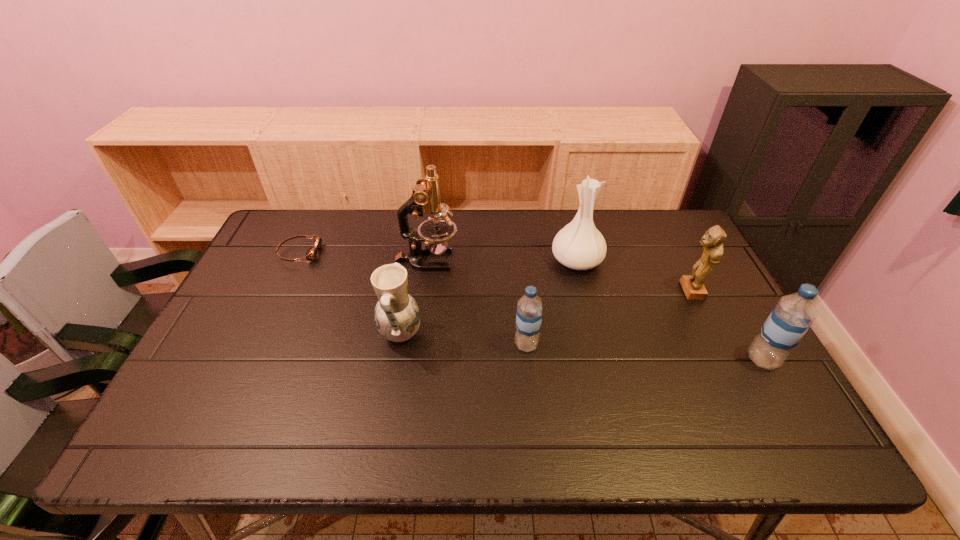
In order to click on the shorter water bottle in this screenshot , I will do `click(529, 307)`.

Image resolution: width=960 pixels, height=540 pixels. What are the coordinates of `the left water bottle` in the screenshot? It's located at (529, 307).

Identify the location of the taller water bottle. The image size is (960, 540). (790, 319).

At what (x,y) coordinates should I click in order to perform the action: click on the rightmost object. Please return your answer as a coordinate pair (x, y). The image size is (960, 540). Looking at the image, I should click on (790, 319).

This screenshot has width=960, height=540. Find the location of `the shortest object`. the shortest object is located at coordinates (311, 254).

This screenshot has width=960, height=540. Find the location of `goggles`. goggles is located at coordinates (311, 254).

Identify the location of the third object from right to left. The height and width of the screenshot is (540, 960). (579, 245).

You are a GUI agent. You are given a task and a screenshot of the screen. Output one action in this format:
    pyautogui.click(x=<x>, y=<y>)
    Task: Click on the microscope
    The height and width of the screenshot is (540, 960).
    Given the screenshot: What is the action you would take?
    pyautogui.click(x=425, y=199)

Locate an element on the screen. This screenshot has height=540, width=960. figurine is located at coordinates (712, 241).

Where is `the second object from right to left`? the second object from right to left is located at coordinates (712, 241).